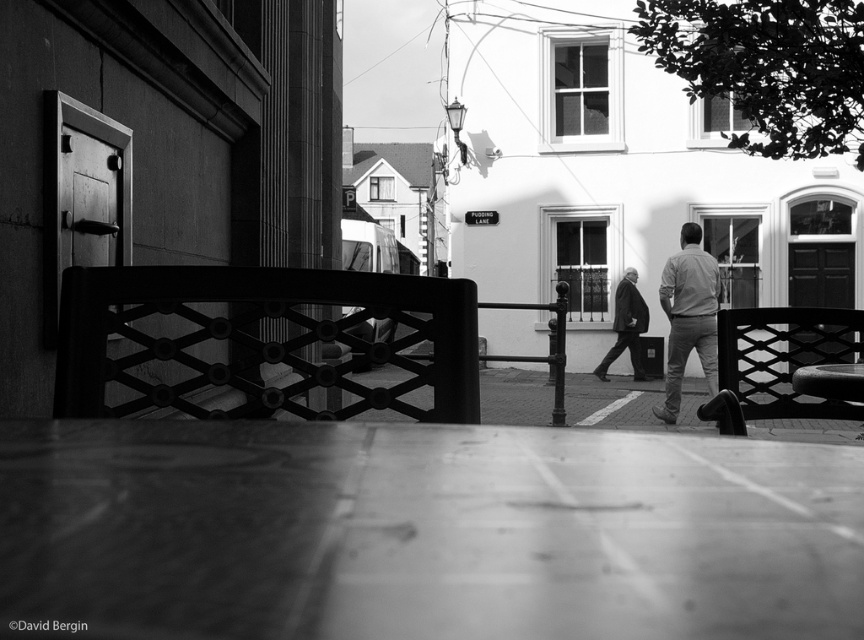
Between point (713, 262) and point (633, 308), which one is positioned behind?

Point (633, 308)

Between light gray shirt at center and dark suit at center, which one is positioned higher?

light gray shirt at center is higher up.

Which is in front, point (715, 385) or point (615, 349)?

Point (715, 385) is more forward.

Where is `light gray shirt at center`? light gray shirt at center is located at coordinates (688, 316).

This screenshot has width=864, height=640. What do you see at coordinates (779, 364) in the screenshot?
I see `smooth wood bench at center` at bounding box center [779, 364].

Locate an element on the screen. smooth wood bench at center is located at coordinates (779, 364).

What do you see at coordinates (422, 532) in the screenshot?
I see `smooth concrete pavement at center` at bounding box center [422, 532].

Does smooth concrete pavement at center have a greater width compared to dark suit at center?

No.

Which is in front, point (151, 520) or point (643, 307)?

Point (151, 520) is more forward.

Find the location of `smooth concrete pavement at center`. smooth concrete pavement at center is located at coordinates (422, 532).